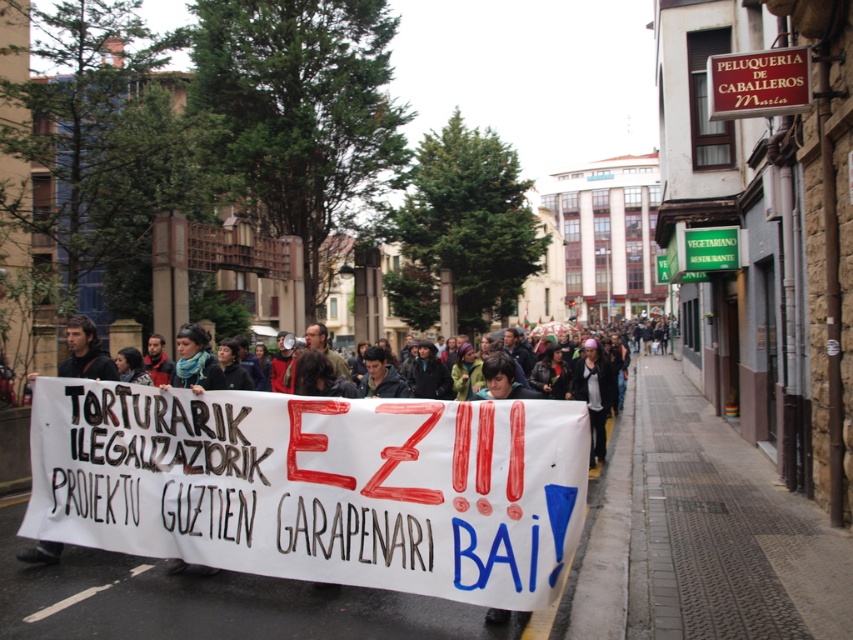
Is point (746, 67) positioned after point (62, 376)?

Yes.

Where is `red wood sign at upper right`? This screenshot has width=853, height=640. red wood sign at upper right is located at coordinates (758, 83).

Is point (456, 595) positioned before point (764, 100)?

Yes, point (456, 595) is closer to viewer.

Which is more to the right, white paper banner at center or red wood sign at upper right?

red wood sign at upper right is more to the right.

What are the coordinates of `white paper banner at center` in the screenshot? It's located at (316, 484).

Is point (380, 458) behind point (183, 326)?

No, it is in front of (183, 326).

Can you confirm if white paper banner at center is taller than blue scarf at center?

Indeed, white paper banner at center has a greater height compared to blue scarf at center.

What do you see at coordinates (316, 484) in the screenshot? I see `white paper banner at center` at bounding box center [316, 484].

At what (x,y) coordinates should I click in order to perform the action: click on white paper banner at center. Please return your answer as a coordinate pair (x, y). The height and width of the screenshot is (640, 853). Looking at the image, I should click on (316, 484).